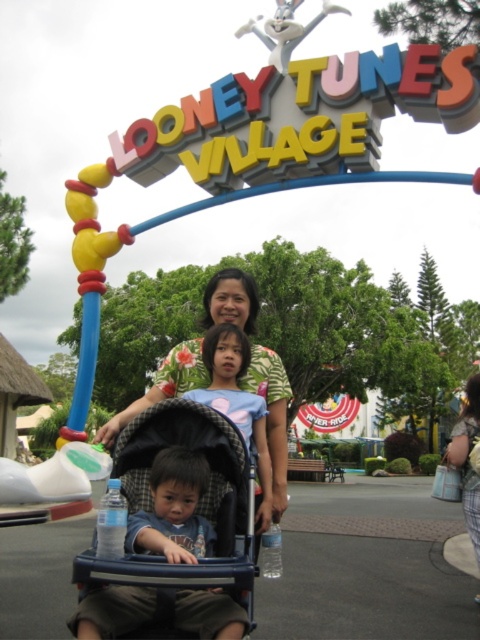
You are a photographer at the theme park and need to position two guests for a better photo. You notice the floral print shirt at center and the floral shirt at center. Which one is positioned to the left?

The floral print shirt at center is to the left of the floral shirt at center.

You are a photographer standing at the center of the scene. You see the floral print shirt at center and the floral shirt at center. Which one is closer to you?

Both the floral print shirt at center and the floral shirt at center are the same object, so they are equally close to you.

You are a photographer at the theme park and need to adjust the camera angle to ensure both the blue plastic baby carriage at center and the blue denim shirt at center are visible in the photo. Based on their positions, which object should you focus on first to frame the shot properly?

The blue plastic baby carriage at center is below the blue denim shirt at center, so you should focus on the blue denim shirt at center first to ensure both are in frame.